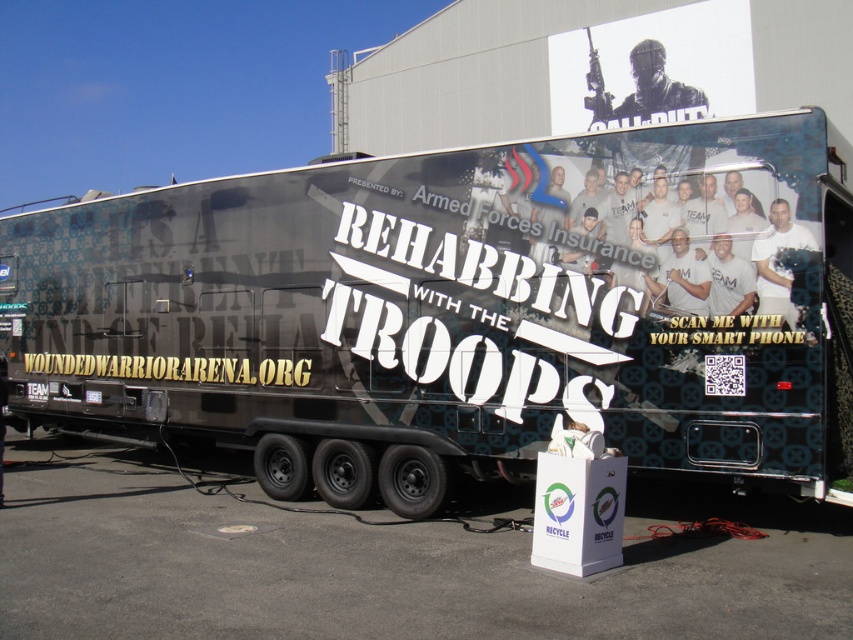
You are a photographer trying to capture both the matte black trailer truck at center and the white cardboard at lower center in a single shot. Given their sizes, which object will appear larger in your photo?

The matte black trailer truck at center will appear larger in the photo because it is bigger than the white cardboard at lower center.

You are a photographer standing in front of the matte black trailer truck at center and the white cardboard at lower center. You want to take a photo that includes both objects but focuses on the closer one. Which object should you focus on?

The matte black trailer truck at center is closer to you than the white cardboard at lower center, so you should focus on the matte black trailer truck at center.